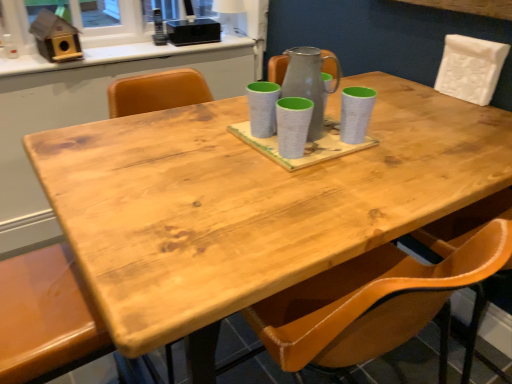
This screenshot has width=512, height=384. I want to click on free space that is to the left of white matte chair at upper right, which is the second chair in left-to-right order, so click(x=414, y=103).